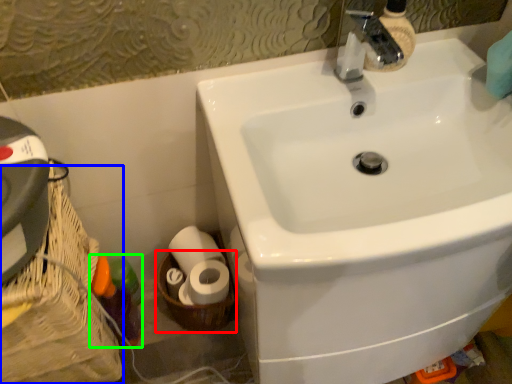
Question: Which object is positioned farthest from basket container (highlighted by a red box)? Select from basket container (highlighted by a blue box) and bottle (highlighted by a green box).

Choices:
 (A) basket container
 (B) bottle

Answer: (A)